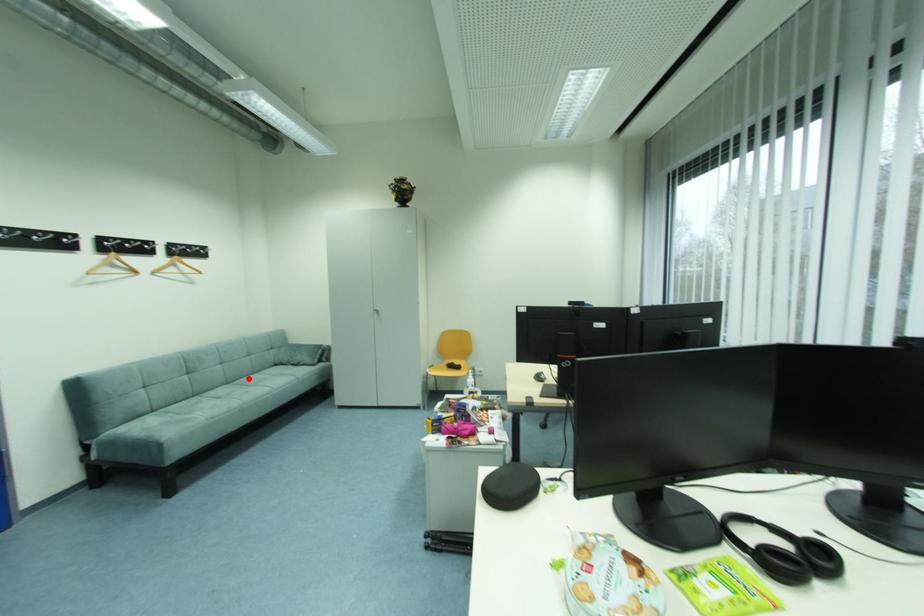
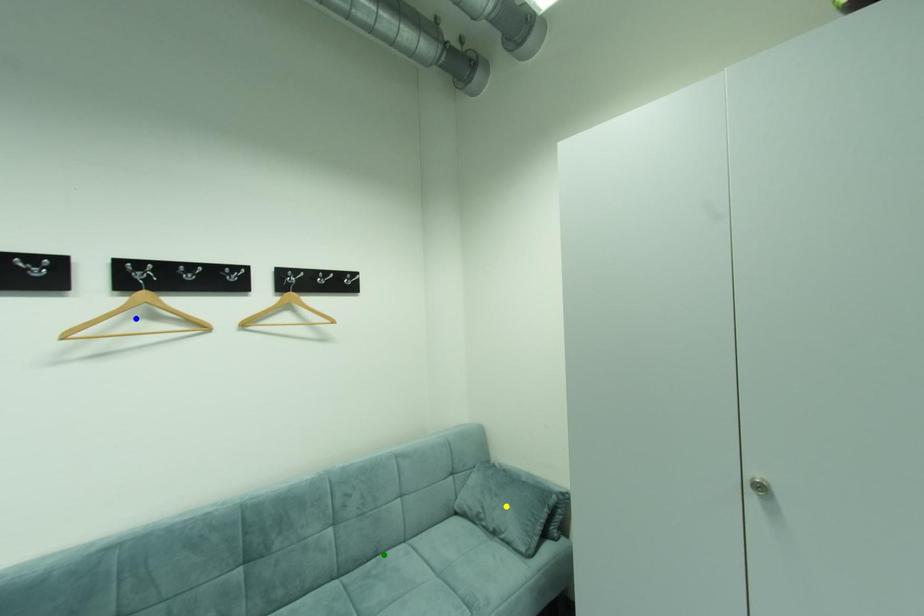
Question: I am providing you with two images of the same scene from different viewpoints. A red point is marked on the first image. You are given multiple points on the second image. Which spot in image 2 lines up with the point in image 1?

Choices:
 (A) blue point
 (B) green point
 (C) yellow point

Answer: (B)